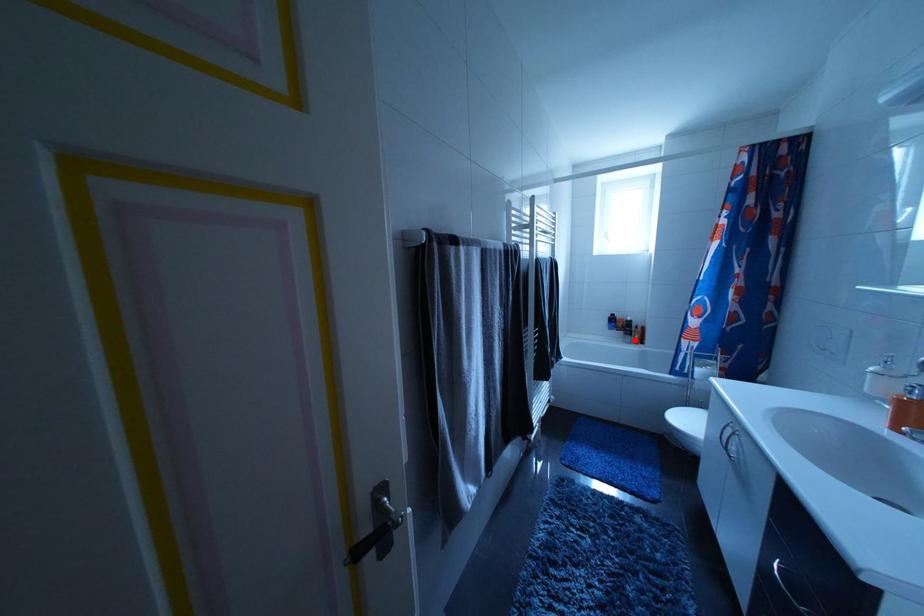
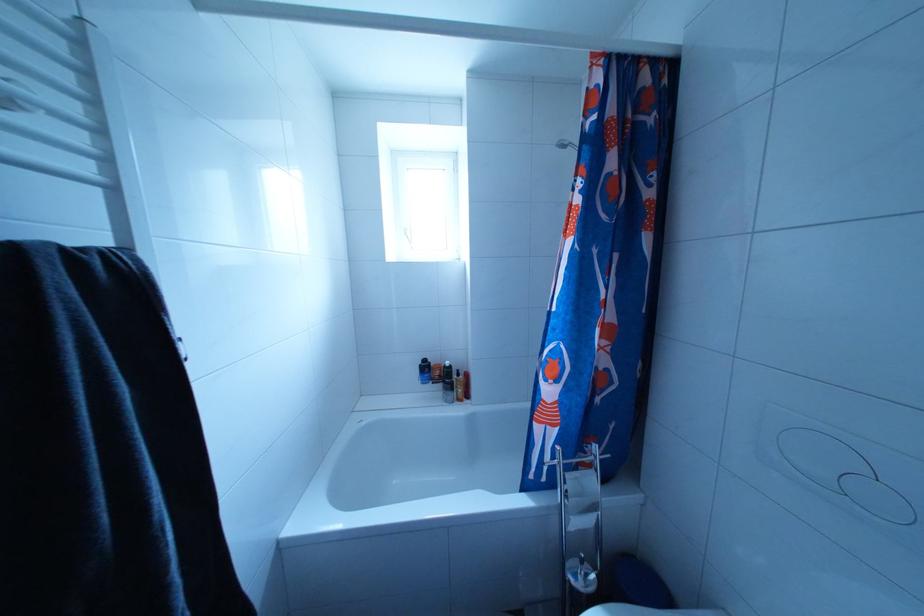
Question: A red point is marked in image1. In image2, is the corresponding 3D point closer to the camera or farther? Reply with the corresponding letter.

Choices:
 (A) The corresponding 3D point is closer.
 (B) The corresponding 3D point is farther.

Answer: (B)